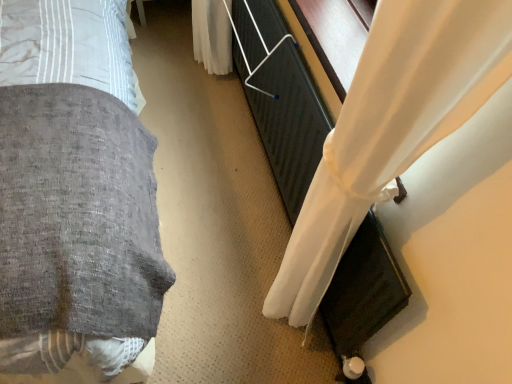
Identify the location of free space underneath white sheer curtain at right (from a real-world perspective). (259, 148).